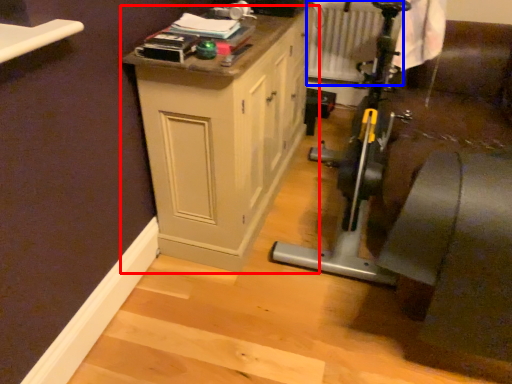
Question: Which point is further to the camera, cabinetry (highlighted by a red box) or radiator (highlighted by a blue box)?

Choices:
 (A) cabinetry
 (B) radiator

Answer: (B)